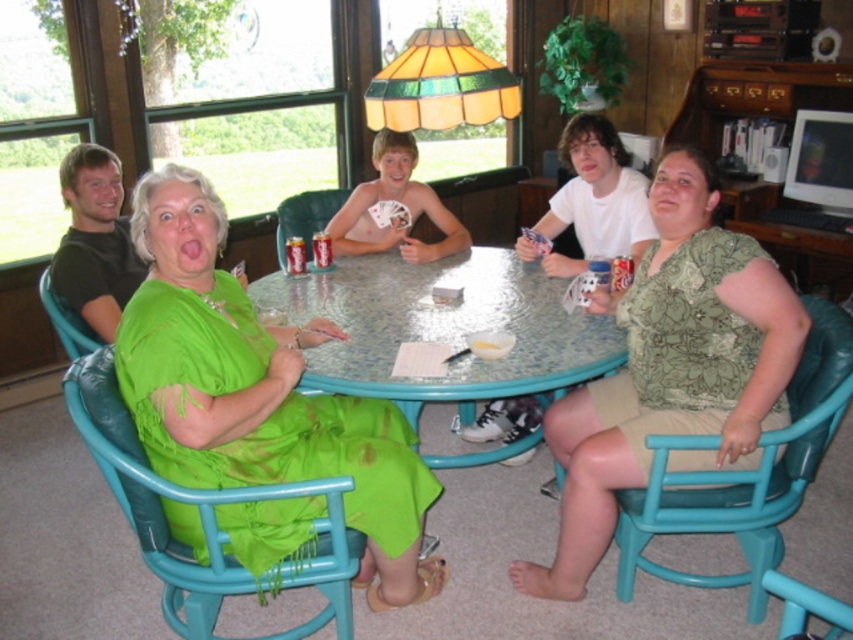
You are standing at the edge of the room and see the point marked at coordinates (x=257, y=392). What object is located there?

The green satin dress at center is located at point (x=257, y=392).

You are planning to sit down at the teal plastic chair at lower left, but you notice the green satin dress at center is nearby. Considering their sizes, do you think the dress might interfere with sitting comfortably?

The green satin dress at center has a larger width than the teal plastic chair at lower left, so it might interfere with sitting comfortably due to its size.